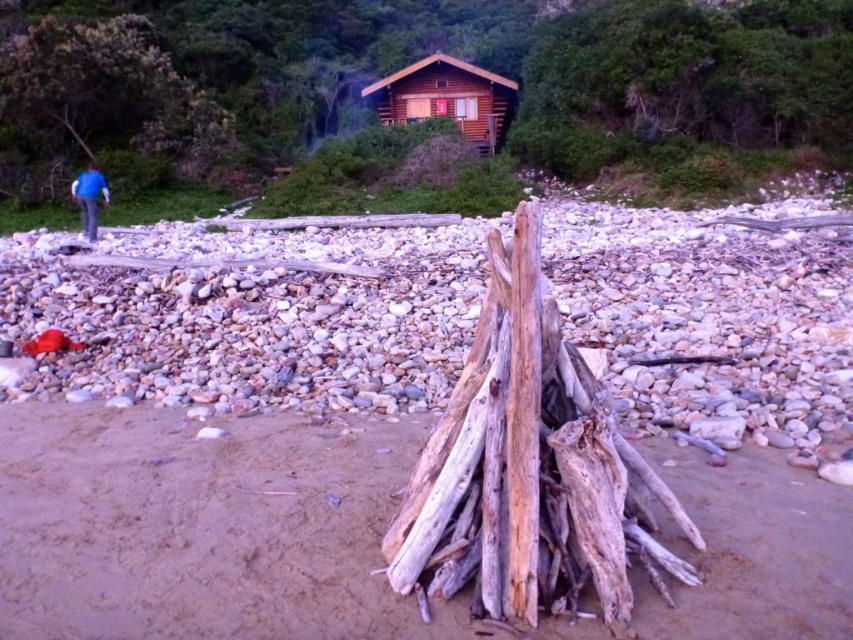
You are an artist setting up your easel to paint the scene. You want to ensure the proportions between the light brown wood at center and the brown wooden log cabin at upper center are accurate. Which object should you depict as having a smaller width in your painting?

The light brown wood at center should be depicted as having a smaller width because it is thinner than the brown wooden log cabin at upper center.

Based on the photo, you are standing on the rocky beach and see the light brown wood at center and the blue fabric jacket at left. Which object is taller?

The blue fabric jacket at left is taller than the light brown wood at center.

In the scene shown: You are packing for a hike and need to decide whether to bring both the light brown wood at center and the blue fabric jacket at left. Considering their sizes, which item should you prioritize packing first?

The light brown wood at center is smaller than the blue fabric jacket at left, so you should prioritize packing the blue fabric jacket at left first because it takes up more space and needs to be placed at the bottom of the bag.